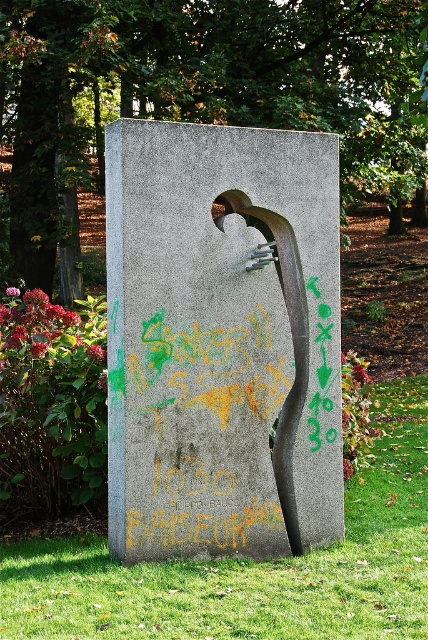
You are a gardener who needs to mow the lawn. You see the gray concrete sculpture at center and the green grass at lower center. Which object is closer to you?

The gray concrete sculpture at center is closer to you because the green grass at lower center is behind it.

You are standing at the monument and want to place a small flag exactly at the green grass at lower center. What are the coordinates where you should place the flag?

The coordinates for placing the flag at the green grass at lower center are point (252, 566).